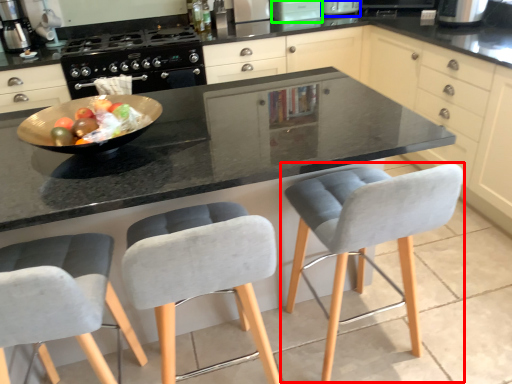
Question: Estimate the real-world distances between objects in this image. Which object is closer to chair (highlighted by a red box), appliance (highlighted by a blue box) or appliance (highlighted by a green box)?

Choices:
 (A) appliance
 (B) appliance

Answer: (B)